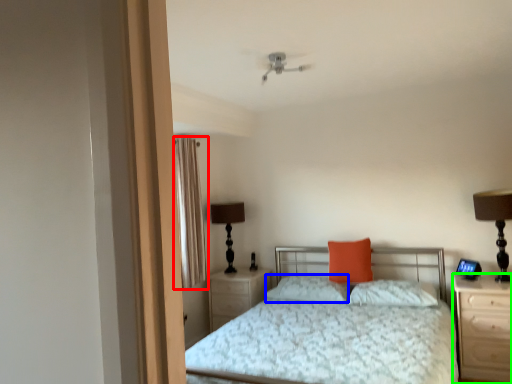
Question: Which object is positioned farthest from curtain (highlighted by a red box)? Select from pillow (highlighted by a blue box) and nightstand (highlighted by a green box).

Choices:
 (A) pillow
 (B) nightstand

Answer: (B)